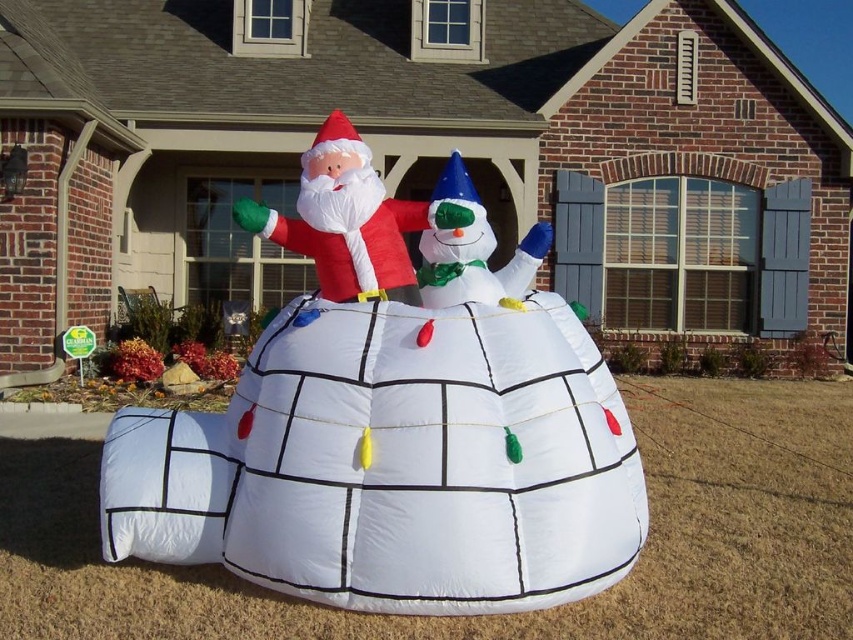
Question: Does matte red santa at center have a smaller size compared to white glossy snowman at center?

Choices:
 (A) no
 (B) yes

Answer: (A)

Question: Does white inflatable snowman at center lie behind white glossy snowman at center?

Choices:
 (A) no
 (B) yes

Answer: (A)

Question: Which of the following is the farthest from the observer?

Choices:
 (A) matte red santa at center
 (B) white glossy snowman at center
 (C) white inflatable snowman at center

Answer: (A)

Question: Which object is closer to the camera taking this photo?

Choices:
 (A) matte red santa at center
 (B) white inflatable snowman at center
 (C) white glossy snowman at center

Answer: (B)

Question: Which object appears closest to the camera in this image?

Choices:
 (A) matte red santa at center
 (B) white glossy snowman at center

Answer: (B)

Question: Observing the image, what is the correct spatial positioning of white inflatable snowman at center in reference to matte red santa at center?

Choices:
 (A) left
 (B) right

Answer: (B)